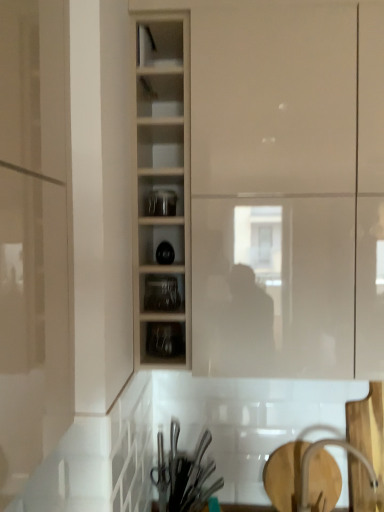
The height and width of the screenshot is (512, 384). Identify the location of wooden shelves at center. (160, 189).

Find the location of a particular element. matte white cupboard at center is located at coordinates (288, 191).

The image size is (384, 512). What do you see at coordinates (320, 449) in the screenshot? I see `white glossy faucet at lower right` at bounding box center [320, 449].

This screenshot has height=512, width=384. What do you see at coordinates (184, 477) in the screenshot?
I see `metallic silver utensils at lower center, acting as the second tableware starting from the top` at bounding box center [184, 477].

Locate an element on the screen. The width and height of the screenshot is (384, 512). clear glass jars at center, which ranks as the second shelf in bottom-to-top order is located at coordinates (162, 294).

Considering the sizes of metallic silver utensils at lower center, which is counted as the 2th tableware, starting from the front, and clear glass jars at center, which is the 1th shelf from bottom to top, in the image, is metallic silver utensils at lower center, which is counted as the 2th tableware, starting from the front, bigger or smaller than clear glass jars at center, which is the 1th shelf from bottom to top,?

metallic silver utensils at lower center, which is counted as the 2th tableware, starting from the front, is bigger than clear glass jars at center, which is the 1th shelf from bottom to top.

Between metallic silver utensils at lower center, which appears as the first tableware when viewed from the back, and clear glass jars at center, the 2th shelf viewed from the top, which one appears on the left side from the viewer's perspective?

clear glass jars at center, the 2th shelf viewed from the top, is more to the left.

What's the angular difference between metallic silver utensils at lower center, which is the 1th tableware from bottom to top, and clear glass jars at center, which is the 1th shelf from bottom to top,'s facing directions?

0.00152 degrees separate the facing orientations of metallic silver utensils at lower center, which is the 1th tableware from bottom to top, and clear glass jars at center, which is the 1th shelf from bottom to top.

Are metallic silver utensils at lower center, which appears as the first tableware when viewed from the back, and clear glass jars at center, the 2th shelf viewed from the top, located far from each other?

No, metallic silver utensils at lower center, which appears as the first tableware when viewed from the back, is not far from clear glass jars at center, the 2th shelf viewed from the top.

Which object is positioned more to the left, clear glass jars at center, the first shelf in the top-to-bottom sequence, or matte white cupboard at center?

clear glass jars at center, the first shelf in the top-to-bottom sequence, is more to the left.

Is clear glass jars at center, the first shelf in the top-to-bottom sequence, far away from matte white cupboard at center?

No, there isn't a large distance between clear glass jars at center, the first shelf in the top-to-bottom sequence, and matte white cupboard at center.

Considering the sizes of objects clear glass jars at center, which ranks as the second shelf in bottom-to-top order, and matte white cupboard at center in the image provided, who is thinner, clear glass jars at center, which ranks as the second shelf in bottom-to-top order, or matte white cupboard at center?

With smaller width is clear glass jars at center, which ranks as the second shelf in bottom-to-top order.

There is a clear glass jars at center, which ranks as the second shelf in bottom-to-top order. Identify the location of cupboard above it (from a real-world perspective). Image resolution: width=384 pixels, height=512 pixels. (288, 191).

Based on the photo, considering the relative sizes of metallic silver utensils at lower center, acting as the second tableware starting from the top, and clear glass jars at center, the first shelf in the top-to-bottom sequence, in the image provided, is metallic silver utensils at lower center, acting as the second tableware starting from the top, shorter than clear glass jars at center, the first shelf in the top-to-bottom sequence,?

In fact, metallic silver utensils at lower center, acting as the second tableware starting from the top, may be taller than clear glass jars at center, the first shelf in the top-to-bottom sequence.

Would you say metallic silver utensils at lower center, which appears as the first tableware when viewed from the back, contains clear glass jars at center, the first shelf in the top-to-bottom sequence?

No, clear glass jars at center, the first shelf in the top-to-bottom sequence, is not a part of metallic silver utensils at lower center, which appears as the first tableware when viewed from the back.

From the image's perspective, is metallic silver utensils at lower center, which is the 1th tableware from bottom to top, below clear glass jars at center, the first shelf in the top-to-bottom sequence?

Yes.

Choose the correct answer: Is white glossy faucet at lower right inside clear glass jars at center, the first shelf in the top-to-bottom sequence, or outside it?

white glossy faucet at lower right is not enclosed by clear glass jars at center, the first shelf in the top-to-bottom sequence.

In the scene shown: Which of these two, white glossy faucet at lower right or clear glass jars at center, the first shelf in the top-to-bottom sequence, is thinner?

With smaller width is clear glass jars at center, the first shelf in the top-to-bottom sequence.

From the picture: Who is more distant, white glossy faucet at lower right or clear glass jars at center, which ranks as the second shelf in bottom-to-top order?

clear glass jars at center, which ranks as the second shelf in bottom-to-top order.

In terms of size, does white glossy faucet at lower right appear bigger or smaller than clear glass jars at center, the first shelf in the top-to-bottom sequence?

In the image, white glossy faucet at lower right appears to be larger than clear glass jars at center, the first shelf in the top-to-bottom sequence.

Does wooden shelves at center turn towards matte white cupboard at center?

No, wooden shelves at center is not turned towards matte white cupboard at center.

Would you say wooden shelves at center is inside or outside matte white cupboard at center?

wooden shelves at center is located beyond the bounds of matte white cupboard at center.

Considering the points (179, 74) and (306, 102), which point is behind, point (179, 74) or point (306, 102)?

The point (179, 74) is farther from the camera.

Looking at this image, considering the positions of objects wooden shelves at center and matte white cupboard at center in the image provided, who is more to the left, wooden shelves at center or matte white cupboard at center?

wooden shelves at center.

Can metallic silver utensils at lower center, which is counted as the 2th tableware, starting from the front, be found inside transparent glass jars at center, the first tableware in the front-to-back sequence?

No.

Where is `tableware on the left of the metallic silver utensils at lower center, acting as the second tableware starting from the top`? This screenshot has width=384, height=512. tableware on the left of the metallic silver utensils at lower center, acting as the second tableware starting from the top is located at coordinates (161, 203).

Would you say transparent glass jars at center, the first tableware in the front-to-back sequence, is a long distance from metallic silver utensils at lower center, which is the 1th tableware from bottom to top?

transparent glass jars at center, the first tableware in the front-to-back sequence, is actually quite close to metallic silver utensils at lower center, which is the 1th tableware from bottom to top.

From the image's perspective, between transparent glass jars at center, the first tableware in the front-to-back sequence, and metallic silver utensils at lower center, which is the 1th tableware from bottom to top, who is located below?

metallic silver utensils at lower center, which is the 1th tableware from bottom to top, is shown below in the image.

Does clear glass jars at center, the first shelf in the top-to-bottom sequence, appear on the left side of metallic silver utensils at lower center, which is counted as the 2th tableware, starting from the front?

Correct, you'll find clear glass jars at center, the first shelf in the top-to-bottom sequence, to the left of metallic silver utensils at lower center, which is counted as the 2th tableware, starting from the front.

Which of these two, clear glass jars at center, the first shelf in the top-to-bottom sequence, or metallic silver utensils at lower center, which appears as the first tableware when viewed from the back, is wider?

clear glass jars at center, the first shelf in the top-to-bottom sequence, is wider.

Locate an element on the screen. This screenshot has height=512, width=384. tableware on the right of clear glass jars at center, which ranks as the second shelf in bottom-to-top order is located at coordinates (184, 477).

Could you tell me if clear glass jars at center, which ranks as the second shelf in bottom-to-top order, is turned towards metallic silver utensils at lower center, acting as the second tableware starting from the top?

No, clear glass jars at center, which ranks as the second shelf in bottom-to-top order, is not aimed at metallic silver utensils at lower center, acting as the second tableware starting from the top.

From a real-world perspective, which shelf is the 1st one above the metallic silver utensils at lower center, which is the 1th tableware from bottom to top? Please provide its 2D coordinates.

[(162, 343)]

Find the location of `cupboard on the right of clear glass jars at center, the first shelf in the top-to-bottom sequence`. cupboard on the right of clear glass jars at center, the first shelf in the top-to-bottom sequence is located at coordinates (288, 191).

Looking at this image, from the image, which object appears to be nearer to matte white cupboard at center, metallic silver utensils at lower center, which appears as the first tableware when viewed from the back, or white glossy faucet at lower right?

metallic silver utensils at lower center, which appears as the first tableware when viewed from the back, lies closer to matte white cupboard at center than the other object.

From the image, which object appears to be farther from white glossy faucet at lower right, transparent glass jars at center, which ranks as the 1th tableware in top-to-bottom order, or clear glass jars at center, which ranks as the second shelf in bottom-to-top order?

Among the two, transparent glass jars at center, which ranks as the 1th tableware in top-to-bottom order, is located further to white glossy faucet at lower right.

Considering their positions, is clear glass jars at center, which ranks as the second shelf in bottom-to-top order, positioned further to transparent glass jars at center, which ranks as the 1th tableware in top-to-bottom order, than clear glass jars at center, which is the 1th shelf from bottom to top?

Among the two, clear glass jars at center, which is the 1th shelf from bottom to top, is located further to transparent glass jars at center, which ranks as the 1th tableware in top-to-bottom order.

Considering their positions, is wooden shelves at center positioned further to transparent glass jars at center, the 2th tableware from the back, than clear glass jars at center, the first shelf in the top-to-bottom sequence?

clear glass jars at center, the first shelf in the top-to-bottom sequence, is positioned further to the anchor transparent glass jars at center, the 2th tableware from the back.

Based on the photo, which object lies nearer to the anchor point transparent glass jars at center, the 2th tableware from the bottom, metallic silver utensils at lower center, which is counted as the 2th tableware, starting from the front, or matte white cupboard at center?

matte white cupboard at center is closer to transparent glass jars at center, the 2th tableware from the bottom.

From the image, which object appears to be farther from white glossy faucet at lower right, metallic silver utensils at lower center, acting as the second tableware starting from the top, or clear glass jars at center, the 2th shelf viewed from the top?

Among the two, clear glass jars at center, the 2th shelf viewed from the top, is located further to white glossy faucet at lower right.

From the image, which object appears to be farther from wooden shelves at center, metallic silver utensils at lower center, which is counted as the 2th tableware, starting from the front, or transparent glass jars at center, the 2th tableware from the back?

Among the two, metallic silver utensils at lower center, which is counted as the 2th tableware, starting from the front, is located further to wooden shelves at center.

Based on their spatial positions, is metallic silver utensils at lower center, which is the 1th tableware from bottom to top, or clear glass jars at center, the 2th shelf viewed from the top, further from wooden shelves at center?

metallic silver utensils at lower center, which is the 1th tableware from bottom to top, is positioned further to the anchor wooden shelves at center.

You are a GUI agent. You are given a task and a screenshot of the screen. Output one action in this format:
    pyautogui.click(x=<x>, y=<y>)
    Task: Click on the shelf between transparent glass jars at center, the 2th tableware from the bottom, and clear glass jars at center, which is the 1th shelf from bottom to top, in the vertical direction
    This screenshot has width=384, height=512.
    Given the screenshot: What is the action you would take?
    click(162, 294)

Identify the location of cupboard between wooden shelves at center and white glossy faucet at lower right from top to bottom. (288, 191).

The height and width of the screenshot is (512, 384). Identify the location of tableware between wooden shelves at center and clear glass jars at center, which is the 1th shelf from bottom to top, vertically. (161, 203).

Locate an element on the screen. tableware that lies between matte white cupboard at center and metallic silver utensils at lower center, acting as the second tableware starting from the top, from top to bottom is located at coordinates (161, 203).